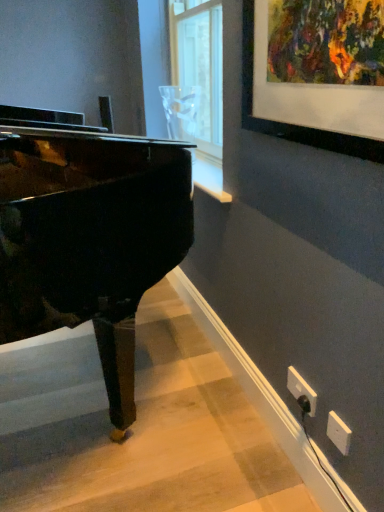
Measure the distance between glossy black piano at left and camera.

35.52 inches.

Describe the element at coordinates (88, 234) in the screenshot. The image size is (384, 512). I see `glossy black piano at left` at that location.

At what (x,y) coordinates should I click in order to perform the action: click on glossy black piano at left. Please return your answer as a coordinate pair (x, y). This screenshot has width=384, height=512. Looking at the image, I should click on (x=88, y=234).

Where is `glossy black piano at left`? glossy black piano at left is located at coordinates (88, 234).